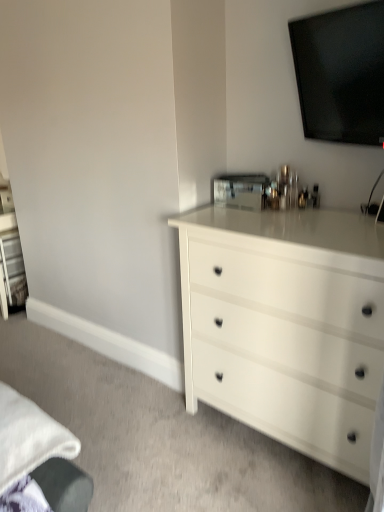
Question: Can you confirm if white glossy chest of drawers at center is shorter than black glossy tv at upper center?

Choices:
 (A) no
 (B) yes

Answer: (A)

Question: Are white glossy chest of drawers at center and black glossy tv at upper center beside each other?

Choices:
 (A) yes
 (B) no

Answer: (B)

Question: Is white glossy chest of drawers at center not close to black glossy tv at upper center?

Choices:
 (A) no
 (B) yes

Answer: (A)

Question: Is white glossy chest of drawers at center thinner than black glossy tv at upper center?

Choices:
 (A) no
 (B) yes

Answer: (A)

Question: From the image's perspective, is white glossy chest of drawers at center below black glossy tv at upper center?

Choices:
 (A) yes
 (B) no

Answer: (A)

Question: Considering the relative sizes of white glossy chest of drawers at center and black glossy tv at upper center in the image provided, is white glossy chest of drawers at center wider than black glossy tv at upper center?

Choices:
 (A) no
 (B) yes

Answer: (B)

Question: Is black glossy tv at upper center thinner than white glossy chest of drawers at center?

Choices:
 (A) yes
 (B) no

Answer: (A)

Question: Would you say black glossy tv at upper center is a long distance from white glossy chest of drawers at center?

Choices:
 (A) yes
 (B) no

Answer: (B)

Question: Considering the relative positions of black glossy tv at upper center and white glossy chest of drawers at center in the image provided, is black glossy tv at upper center behind white glossy chest of drawers at center?

Choices:
 (A) yes
 (B) no

Answer: (A)

Question: Is black glossy tv at upper center completely or partially outside of white glossy chest of drawers at center?

Choices:
 (A) yes
 (B) no

Answer: (A)

Question: From the image's perspective, is black glossy tv at upper center on white glossy chest of drawers at center?

Choices:
 (A) yes
 (B) no

Answer: (A)

Question: Is black glossy tv at upper center smaller than white glossy chest of drawers at center?

Choices:
 (A) yes
 (B) no

Answer: (A)

Question: Is point (352, 39) closer or farther from the camera than point (215, 222)?

Choices:
 (A) farther
 (B) closer

Answer: (B)